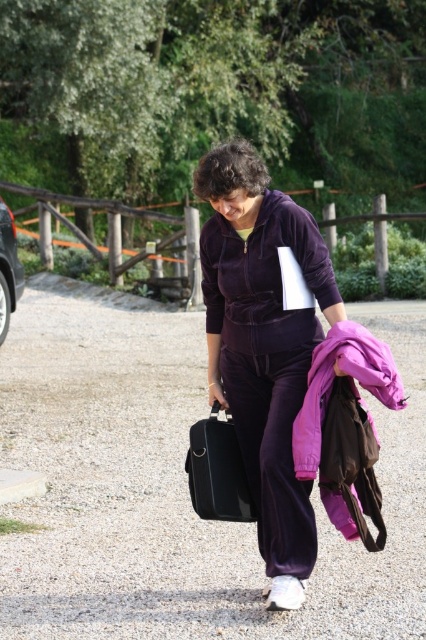
You are a delivery person who needs to place the black leather briefcase at center onto the trunk of the metallic silver car at left. Can you do this without moving the car?

The black leather briefcase at center is positioned under the metallic silver car at left, so you cannot place it onto the trunk without moving the car first.

You are a photographer positioned on the gravel path. You want to take a photo of the velvet purple tracksuit at center and the black leather briefcase at center. Which object should you focus on first to ensure both are in sharp focus?

The velvet purple tracksuit at center is closer to the viewer than the black leather briefcase at center, so focus on the velvet purple tracksuit at center first to ensure both are in sharp focus.